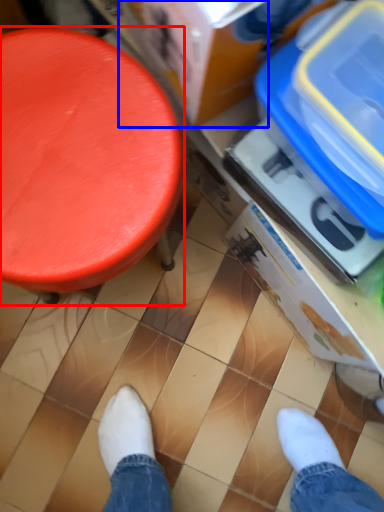
Question: Which object is closer to the camera taking this photo, furniture (highlighted by a red box) or storage box (highlighted by a blue box)?

Choices:
 (A) furniture
 (B) storage box

Answer: (B)